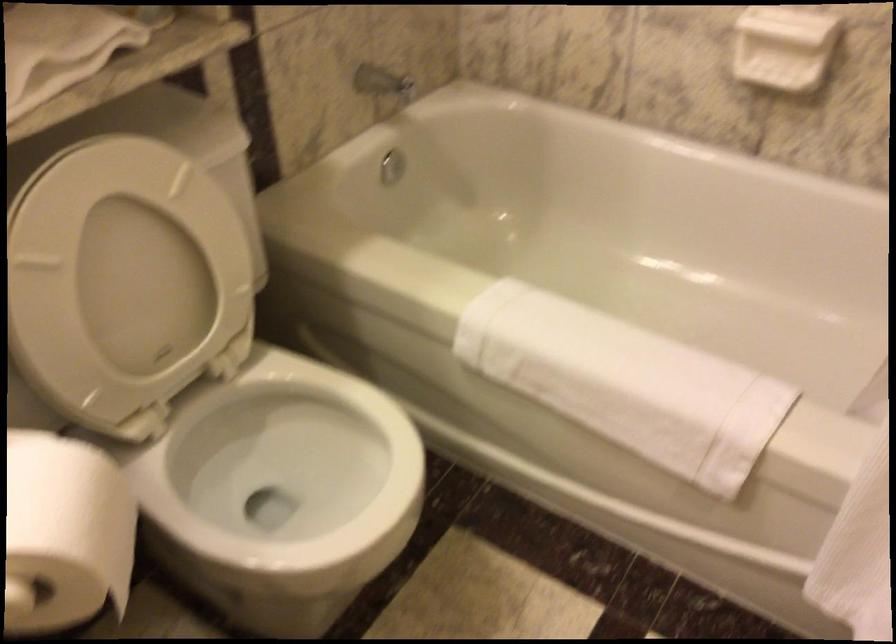
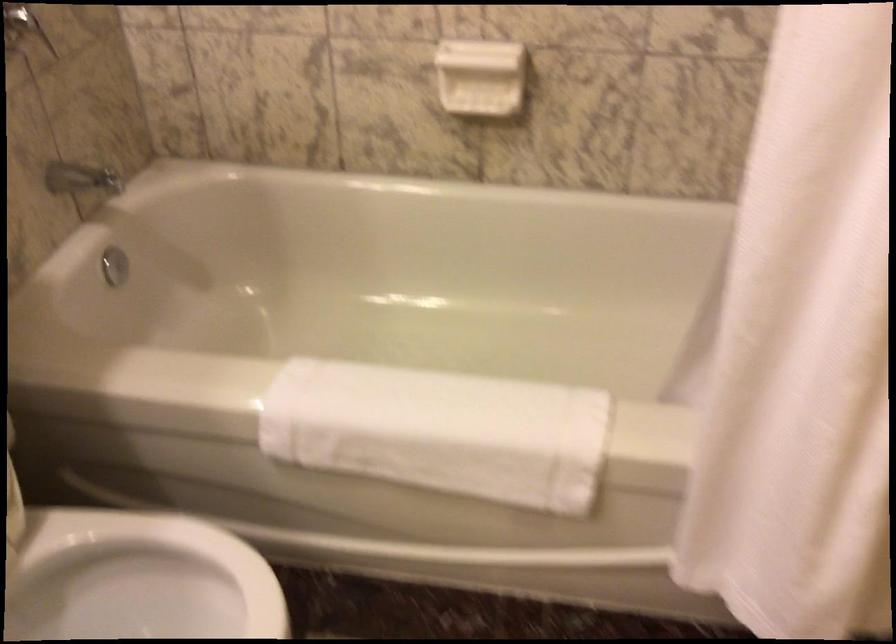
Question: The first image is from the beginning of the video and the second image is from the end. How did the camera likely rotate when shooting the video?

Choices:
 (A) Left
 (B) Right
 (C) Up
 (D) Down

Answer: (B)